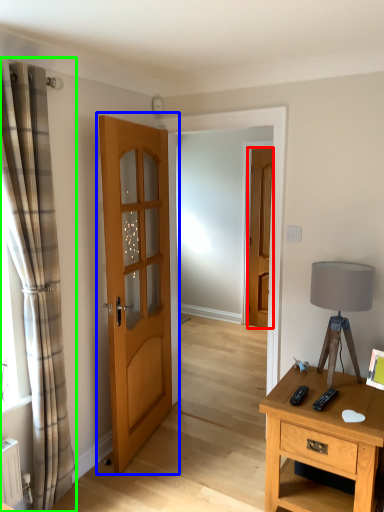
Question: Considering the real-world distances, which object is closest to door (highlighted by a red box)? door (highlighted by a blue box) or curtain (highlighted by a green box).

Choices:
 (A) door
 (B) curtain

Answer: (A)